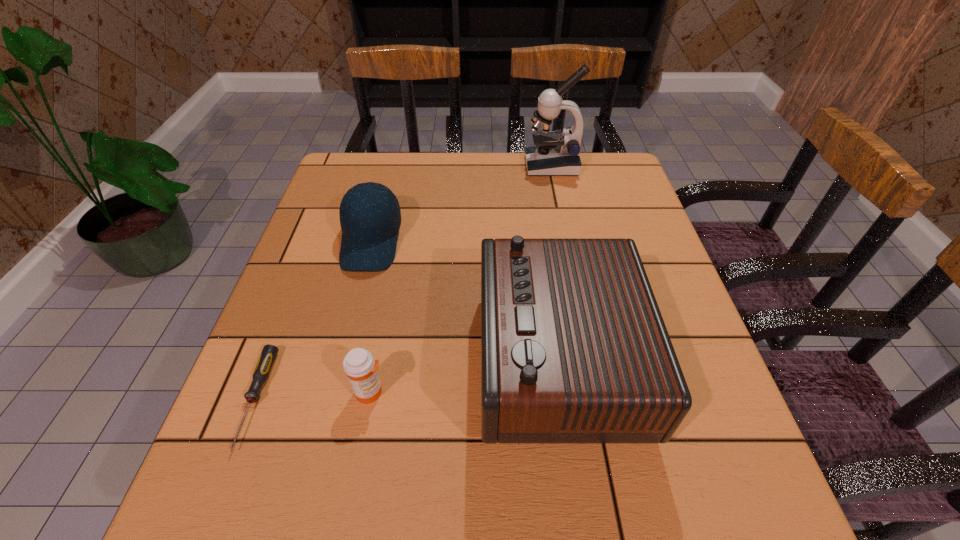
Locate an element on the screen. The width and height of the screenshot is (960, 540). vacant space that satisfies the following two spatial constraints: 1. on the front panel of the radio receiver; 2. insert the shortest object into a screw head is located at coordinates (564, 400).

In order to click on vacant space that satisfies the following two spatial constraints: 1. on the front panel of the radio receiver; 2. insert the screwdriver into a screw head in this screenshot , I will do `click(564, 400)`.

Locate an element on the screen. The image size is (960, 540). vacant space that satisfies the following two spatial constraints: 1. on the front panel of the second tallest object; 2. insert the leftmost object into a screw head is located at coordinates (564, 400).

The width and height of the screenshot is (960, 540). In order to click on free spot that satisfies the following two spatial constraints: 1. at the eyepiece of the microscope; 2. on the front-facing side of the third shortest object in this screenshot , I will do `click(567, 242)`.

Image resolution: width=960 pixels, height=540 pixels. Find the location of `free spot that satisfies the following two spatial constraints: 1. on the front panel of the second tallest object; 2. insert the shortest object into a screw head`. free spot that satisfies the following two spatial constraints: 1. on the front panel of the second tallest object; 2. insert the shortest object into a screw head is located at coordinates (564, 400).